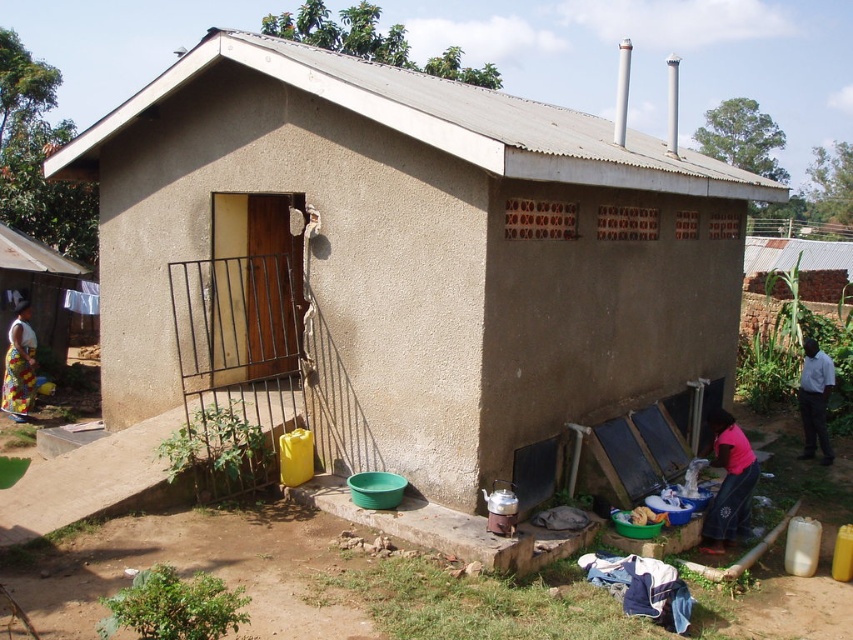
Question: Does pink fabric at lower right have a larger size compared to printed fabric skirt at lower left?

Choices:
 (A) yes
 (B) no

Answer: (A)

Question: Considering the real-world distances, which object is closest to the brown stucco hut at center?

Choices:
 (A) faded denim jacket at lower right
 (B) pink fabric at lower right
 (C) printed fabric skirt at lower left

Answer: (A)

Question: Is brown stucco hut at center smaller than printed fabric skirt at lower left?

Choices:
 (A) no
 (B) yes

Answer: (B)

Question: Which point is farther to the camera?

Choices:
 (A) (32, 358)
 (B) (802, 380)

Answer: (B)

Question: Which point is closer to the camera?

Choices:
 (A) brown stucco hut at center
 (B) white shirt at right
 (C) printed fabric skirt at lower left
 (D) pink fabric at lower right

Answer: (A)

Question: Considering the relative positions of faded denim jacket at lower right and pink fabric at lower right in the image provided, where is faded denim jacket at lower right located with respect to pink fabric at lower right?

Choices:
 (A) above
 (B) below

Answer: (B)